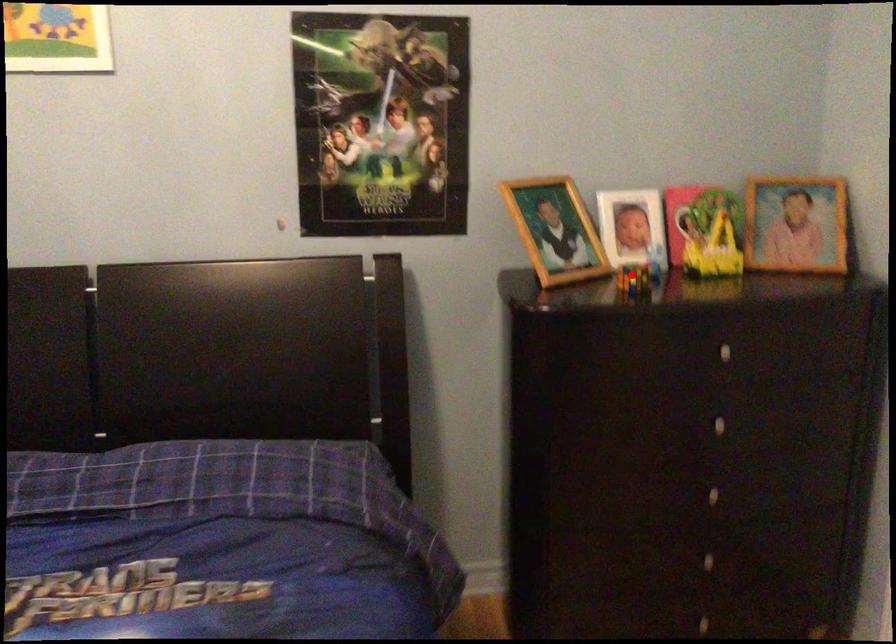
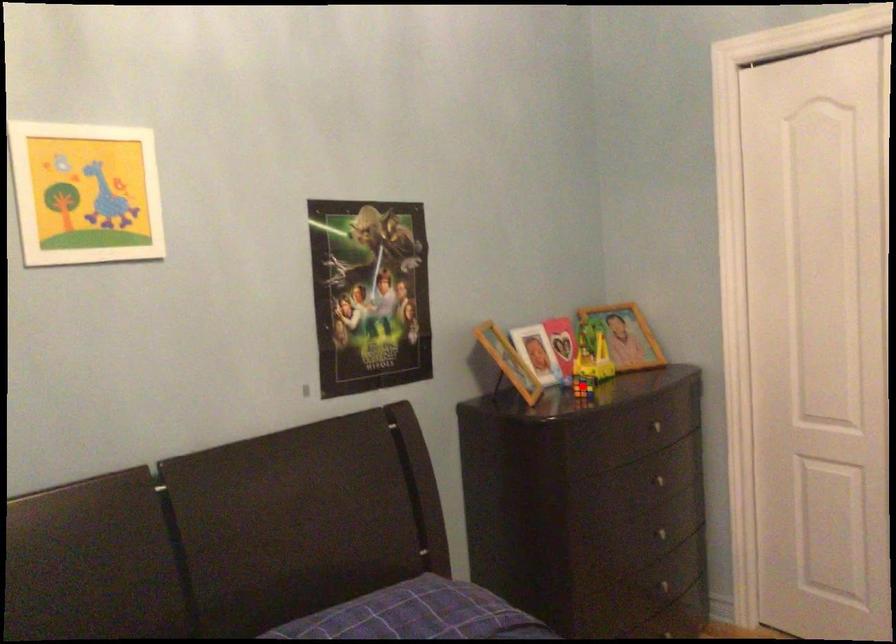
I am providing you with two images of the same scene from different viewpoints. A red point is marked on the first image and another point is marked on the second image. Is the marked point in image1 the same physical position as the marked point in image2?

Yes